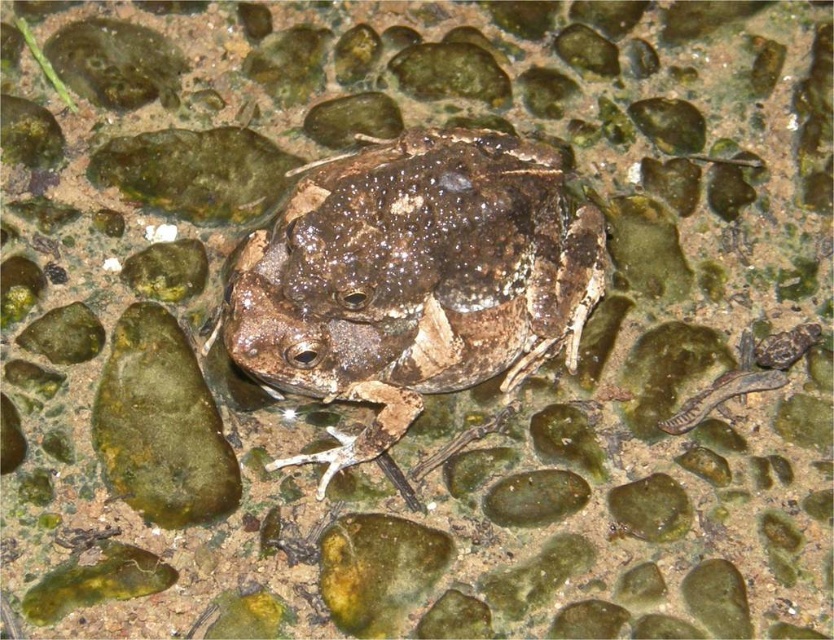
Question: Can you confirm if speckled brown skin at center is positioned to the left of green mossy rock at center?

Choices:
 (A) yes
 (B) no

Answer: (B)

Question: Which point is closer to the camera?

Choices:
 (A) green mossy rock at center
 (B) speckled brown skin at center

Answer: (B)

Question: Is speckled brown skin at center to the right of green mossy rock at center from the viewer's perspective?

Choices:
 (A) yes
 (B) no

Answer: (A)

Question: Which point is closer to the camera?

Choices:
 (A) speckled brown skin at center
 (B) green mossy rock at center

Answer: (A)

Question: Which point is closer to the camera?

Choices:
 (A) green mossy rock at center
 (B) speckled brown skin at center

Answer: (B)

Question: Can you confirm if speckled brown skin at center is smaller than green mossy rock at center?

Choices:
 (A) yes
 (B) no

Answer: (B)